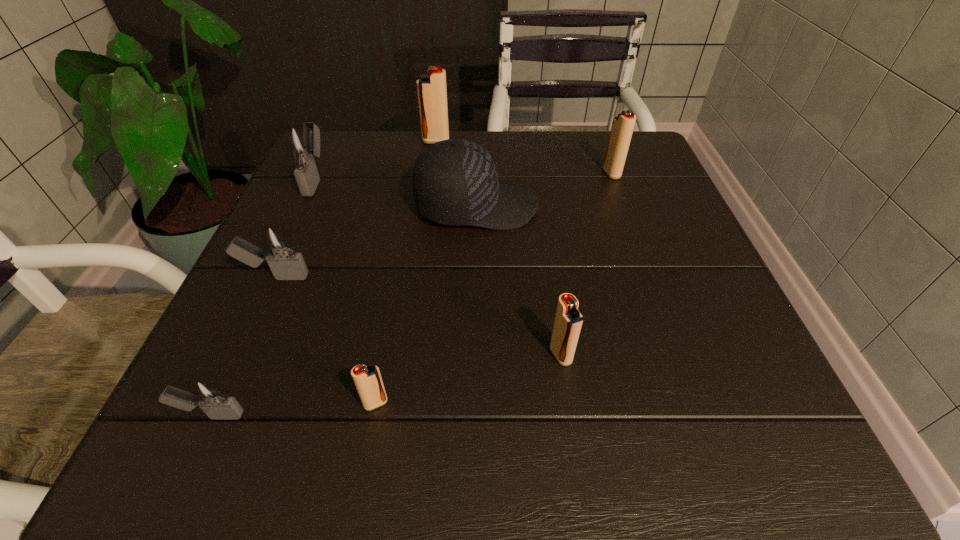
This screenshot has height=540, width=960. In order to click on baseball cap at the far edge in this screenshot , I will do `click(455, 182)`.

Find the location of `object that is at the right edge`. object that is at the right edge is located at coordinates (622, 128).

Locate an element on the screen. The height and width of the screenshot is (540, 960). object at the far left corner is located at coordinates (301, 142).

Where is `object positioned at the near left corner`? This screenshot has height=540, width=960. object positioned at the near left corner is located at coordinates (206, 393).

Locate an element on the screen. object located in the far right corner section of the desktop is located at coordinates (622, 128).

In order to click on free region at the far edge of the desktop in this screenshot , I will do pos(517,136).

The width and height of the screenshot is (960, 540). In the image, there is a desktop. In order to click on vacant space at the near edge in this screenshot , I will do `click(332, 450)`.

Find the location of a particular element. This screenshot has height=540, width=960. vacant space at the left edge of the desktop is located at coordinates (228, 386).

Locate an element on the screen. This screenshot has width=960, height=540. free space at the right edge is located at coordinates (620, 214).

The image size is (960, 540). In the image, there is a desktop. Identify the location of blank space at the far left corner. (347, 143).